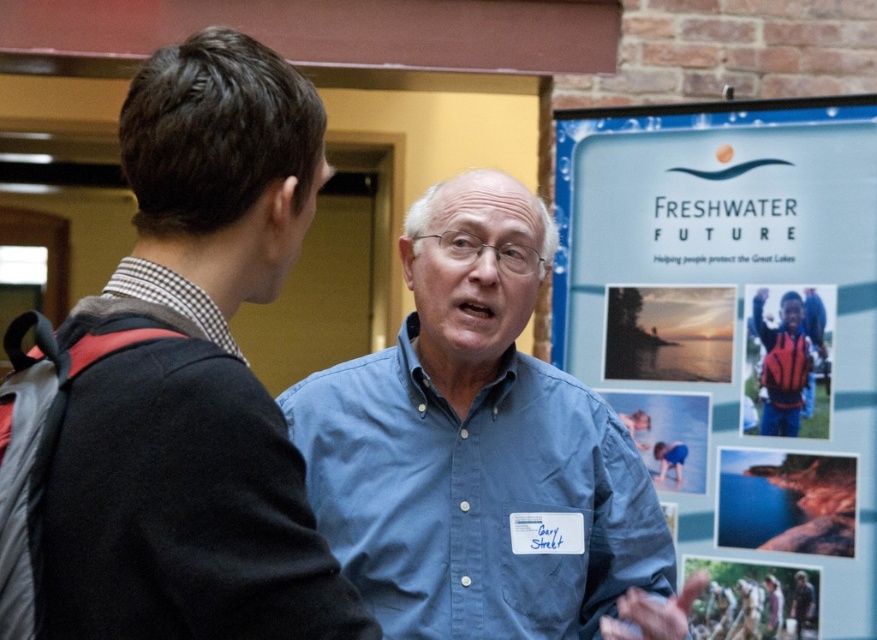
The image size is (877, 640). Describe the element at coordinates (175, 385) in the screenshot. I see `blue button-up shirt at center` at that location.

Does blue button-up shirt at center have a greater width compared to red and black jacket at center?

Yes, blue button-up shirt at center is wider than red and black jacket at center.

Is point (232, 534) farther from viewer compared to point (803, 337)?

No.

Locate an element on the screen. This screenshot has height=640, width=877. blue button-up shirt at center is located at coordinates (175, 385).

Does blue button-up shirt at center have a greater width compared to checkered fabric shirt at left?

Yes, blue button-up shirt at center is wider than checkered fabric shirt at left.

Who is more distant from viewer, (91,508) or (169,292)?

Point (169,292)

What do you see at coordinates (175, 385) in the screenshot?
I see `blue button-up shirt at center` at bounding box center [175, 385].

At what (x,y) coordinates should I click in order to perform the action: click on blue button-up shirt at center. Please return your answer as a coordinate pair (x, y). This screenshot has height=640, width=877. Looking at the image, I should click on (175, 385).

Between blue paperboard at right and checkered fabric shirt at left, which one has less height?

Standing shorter between the two is checkered fabric shirt at left.

Who is lower down, blue paperboard at right or checkered fabric shirt at left?

Positioned lower is blue paperboard at right.

You are a GUI agent. You are given a task and a screenshot of the screen. Output one action in this format:
    pyautogui.click(x=<x>, y=<y>)
    Task: Click on the blue paperboard at right
    The height and width of the screenshot is (640, 877).
    Given the screenshot: What is the action you would take?
    pyautogui.click(x=735, y=340)

You are a GUI agent. You are given a task and a screenshot of the screen. Output one action in this format:
    pyautogui.click(x=<x>, y=<y>)
    Task: Click on the blue paperboard at right
    Image resolution: width=877 pixels, height=640 pixels.
    Given the screenshot: What is the action you would take?
    pyautogui.click(x=735, y=340)